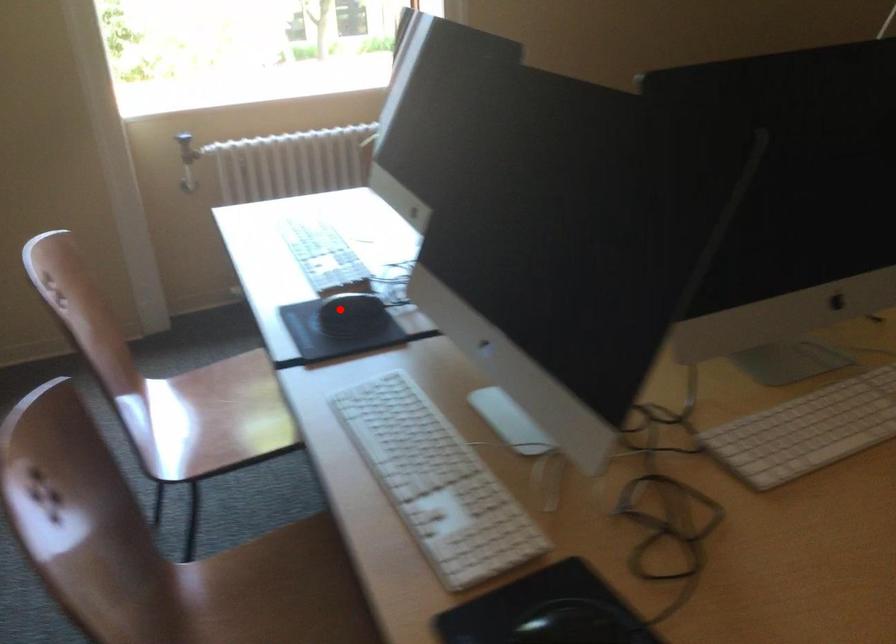
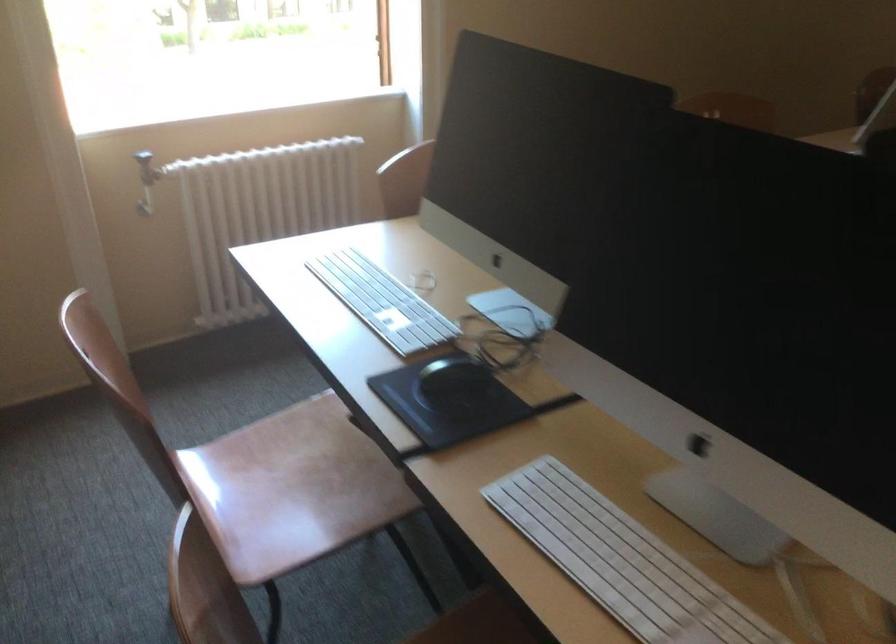
In the second image, find the point that corresponds to the highlighted location in the first image.

(452, 383)